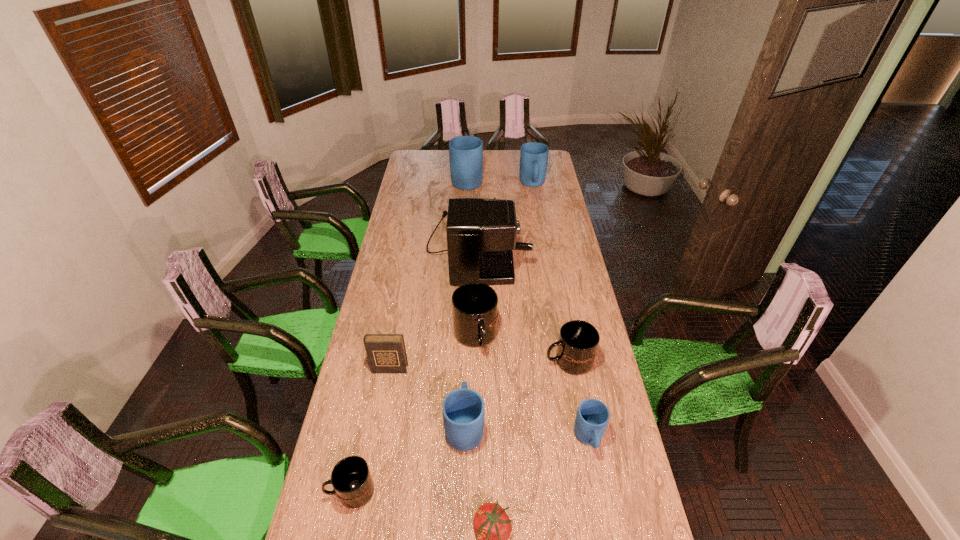
Locate an element on the screen. Image resolution: width=960 pixels, height=540 pixels. the third closest blue mug relative to the dark diary is located at coordinates (465, 152).

Identify which black mug is the nearest to the rightmost black mug. Please provide its 2D coordinates. Your answer should be formatted as a tuple, i.e. [(x, y)], where the tuple contains the x and y coordinates of a point satisfying the conditions above.

[(474, 305)]

Identify which black mug is located as the second nearest to the second black mug from left to right. Please provide its 2D coordinates. Your answer should be formatted as a tuple, i.e. [(x, y)], where the tuple contains the x and y coordinates of a point satisfying the conditions above.

[(351, 479)]

Locate an element on the screen. The image size is (960, 540). free region that satisfies the following two spatial constraints: 1. with the handle on the side of the second black mug from right to left; 2. with the handle on the side of the leftmost mug is located at coordinates (474, 491).